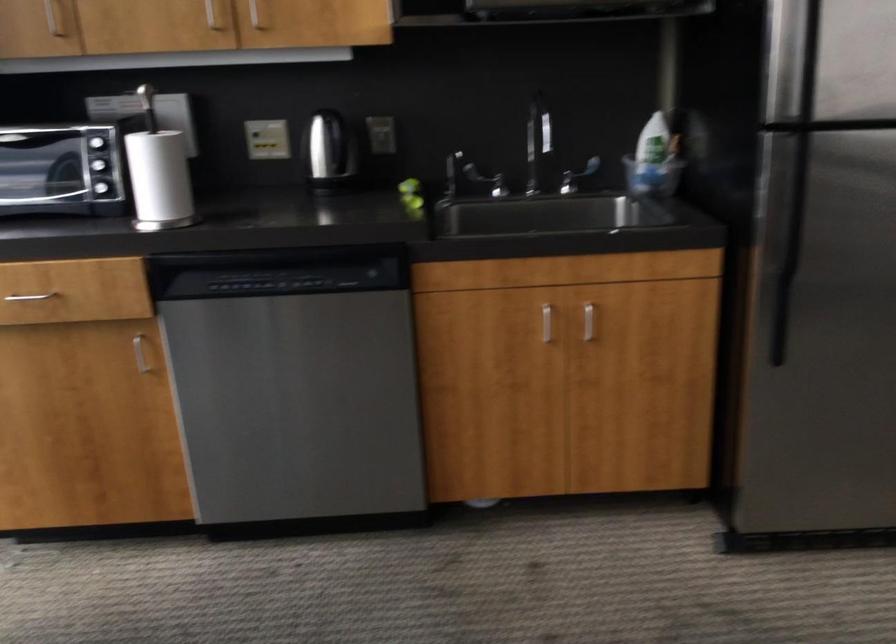
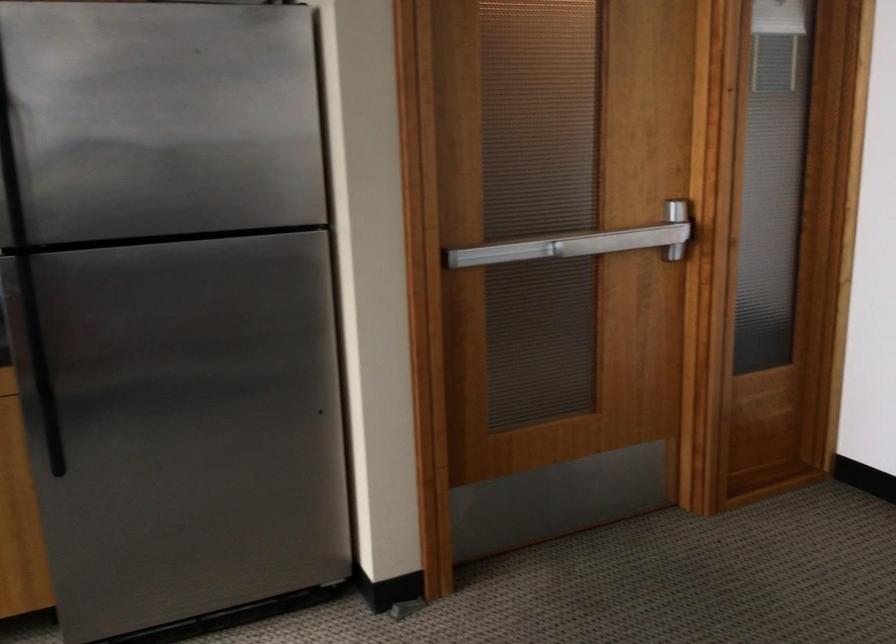
Question: The camera is either moving clockwise (left) or counter-clockwise (right) around the object. The first image is from the beginning of the video and the second image is from the end. Is the camera moving left or right when shooting the video?

Choices:
 (A) Left
 (B) Right

Answer: (A)